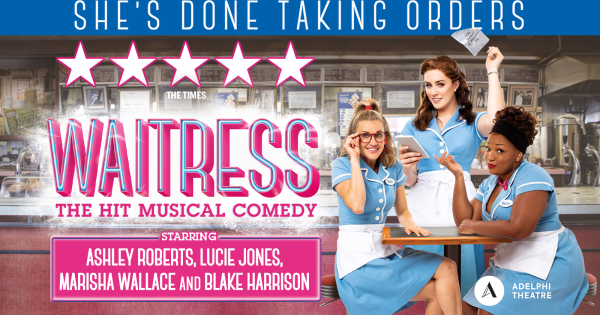
At what (x,y) coordinates should I click in order to perform the action: click on diner table top. Please return your answer as a coordinate pair (x, y). Image resolution: width=600 pixels, height=315 pixels. Looking at the image, I should click on pos(436,234).